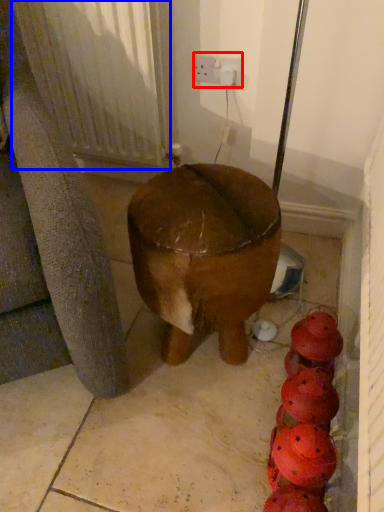
Question: Which object appears closest to the camera in this image, electric outlet (highlighted by a red box) or radiator (highlighted by a blue box)?

Choices:
 (A) electric outlet
 (B) radiator

Answer: (B)